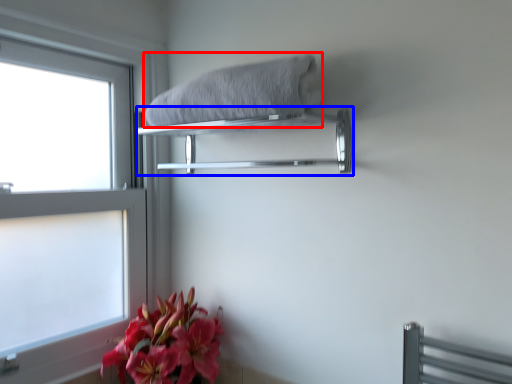
Question: Which point is closer to the camera, bath towel (highlighted by a red box) or balustrade (highlighted by a blue box)?

Choices:
 (A) bath towel
 (B) balustrade

Answer: (A)